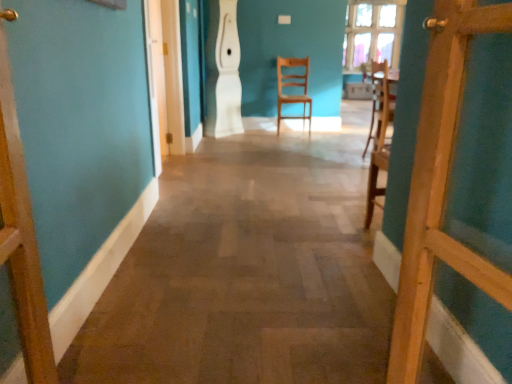
What do you see at coordinates (246, 274) in the screenshot?
I see `wooden floor at center` at bounding box center [246, 274].

What is the approximate width of wooden chair at right, placed as the second chair when sorted from left to right?

It is 13.85 inches.

This screenshot has height=384, width=512. Describe the element at coordinates (441, 182) in the screenshot. I see `wooden door at right` at that location.

You are a GUI agent. You are given a task and a screenshot of the screen. Output one action in this format:
    pyautogui.click(x=<x>, y=<y>)
    Task: Click on the light wood chair at center, placed as the second chair when sorted from front to back
    Image resolution: width=512 pixels, height=384 pixels.
    Given the screenshot: What is the action you would take?
    293,86

Between wooden door at right and wooden floor at center, which one has larger size?

With larger size is wooden floor at center.

Looking at this image, how far apart are wooden door at right and wooden floor at center?

wooden door at right and wooden floor at center are 39.05 inches apart.

Visually, is wooden door at right positioned to the left or to the right of wooden floor at center?

From the image, it's evident that wooden door at right is to the right of wooden floor at center.

Is wooden door at right taller or shorter than wooden floor at center?

In the image, wooden door at right appears to be taller than wooden floor at center.

Consider the image. From a real-world perspective, which is physically below, wooden door at right or wooden chair at right, the 1th chair positioned from the front?

wooden chair at right, the 1th chair positioned from the front, is physically lower.

From the image's perspective, which is above, wooden door at right or wooden chair at right, placed as the second chair when sorted from left to right?

From the image's view, wooden chair at right, placed as the second chair when sorted from left to right, is above.

Does wooden door at right have a greater height compared to wooden chair at right, the 2th chair viewed from the back?

Correct, wooden door at right is much taller as wooden chair at right, the 2th chair viewed from the back.

Which is closer to the camera, [374,47] or [504,239]?

The point [504,239] is closer to the camera.

This screenshot has width=512, height=384. In order to click on door lying on the left of clear glass window at upper center in this screenshot , I will do 441,182.

From a real-world perspective, between clear glass window at upper center and wooden door at right, who is vertically lower?

wooden door at right, from a real-world perspective.

Can wooden door at right be found inside clear glass window at upper center?

No.

Is wooden door at right not inside light wood chair at center, positioned as the 2th chair in right-to-left order?

Absolutely, wooden door at right is external to light wood chair at center, positioned as the 2th chair in right-to-left order.

Can you confirm if wooden door at right is bigger than light wood chair at center, placed as the second chair when sorted from front to back?

Actually, wooden door at right might be smaller than light wood chair at center, placed as the second chair when sorted from front to back.

Would you say wooden door at right is a long distance from light wood chair at center, the 1th chair viewed from the back?

That's right, there is a large distance between wooden door at right and light wood chair at center, the 1th chair viewed from the back.

From the image's perspective, starting from the wooden door at right, which chair is the 2nd one above? Please provide its 2D coordinates.

[(293, 86)]

Considering the points (392, 102) and (392, 301), which point is behind, point (392, 102) or point (392, 301)?

Positioned behind is point (392, 102).

From the image's perspective, between wooden chair at right, the 2th chair viewed from the back, and wooden floor at center, which one is located above?

From the image's view, wooden chair at right, the 2th chair viewed from the back, is above.

Is wooden chair at right, the 2th chair viewed from the back, oriented towards wooden floor at center?

No, wooden chair at right, the 2th chair viewed from the back, is not oriented towards wooden floor at center.

Looking at their sizes, would you say wooden chair at right, the 2th chair viewed from the back, is wider or thinner than wooden floor at center?

wooden chair at right, the 2th chair viewed from the back, is thinner than wooden floor at center.

How different are the orientations of clear glass window at upper center and light wood chair at center, the first chair when ordered from left to right, in degrees?

The facing directions of clear glass window at upper center and light wood chair at center, the first chair when ordered from left to right, are 1.35 degrees apart.

How much distance is there between clear glass window at upper center and light wood chair at center, the first chair when ordered from left to right?

They are 3.63 feet apart.

Is clear glass window at upper center placed right next to light wood chair at center, placed as the second chair when sorted from front to back?

No, clear glass window at upper center is not making contact with light wood chair at center, placed as the second chair when sorted from front to back.

In terms of height, does clear glass window at upper center look taller or shorter compared to light wood chair at center, the first chair when ordered from left to right?

clear glass window at upper center is shorter than light wood chair at center, the first chair when ordered from left to right.

Looking at this image, is the depth of light wood chair at center, positioned as the 2th chair in right-to-left order, less than that of wooden door at right?

That is False.

Does light wood chair at center, the first chair when ordered from left to right, have a lesser height compared to wooden door at right?

Yes.

Is light wood chair at center, placed as the second chair when sorted from front to back, turned away from wooden door at right?

light wood chair at center, placed as the second chair when sorted from front to back, does not have its back to wooden door at right.

From the image's perspective, is light wood chair at center, placed as the second chair when sorted from front to back, under wooden door at right?

Incorrect, from the image's perspective, light wood chair at center, placed as the second chair when sorted from front to back, is higher than wooden door at right.

This screenshot has height=384, width=512. I want to click on alley above the wooden door at right (from the image's perspective), so click(246, 274).

Where is `the 1st chair behind the wooden door at right`? Image resolution: width=512 pixels, height=384 pixels. the 1st chair behind the wooden door at right is located at coordinates (379, 98).

Based on their spatial positions, is wooden floor at center or wooden chair at right, the 2th chair viewed from the back, further from clear glass window at upper center?

wooden floor at center.

Which object lies nearer to the anchor point wooden floor at center, clear glass window at upper center or light wood chair at center, the 1th chair viewed from the back?

light wood chair at center, the 1th chair viewed from the back, is positioned closer to the anchor wooden floor at center.

Looking at the image, which one is located closer to wooden floor at center, wooden door at right or clear glass window at upper center?

wooden door at right is closer to wooden floor at center.

Estimate the real-world distances between objects in this image. Which object is further from light wood chair at center, the 1th chair viewed from the back, wooden chair at right, the 1th chair positioned from the front, or clear glass window at upper center?

wooden chair at right, the 1th chair positioned from the front.

Looking at the image, which one is located closer to wooden floor at center, wooden chair at right, the 2th chair viewed from the back, or light wood chair at center, positioned as the 2th chair in right-to-left order?

Among the two, wooden chair at right, the 2th chair viewed from the back, is located nearer to wooden floor at center.

Considering their positions, is wooden chair at right, the first chair viewed from the right, positioned closer to light wood chair at center, placed as the second chair when sorted from front to back, than wooden door at right?

wooden chair at right, the first chair viewed from the right, lies closer to light wood chair at center, placed as the second chair when sorted from front to back, than the other object.

From the image, which object appears to be nearer to wooden chair at right, the 1th chair positioned from the front, wooden floor at center or light wood chair at center, the first chair when ordered from left to right?

wooden floor at center is closer to wooden chair at right, the 1th chair positioned from the front.

Based on their spatial positions, is wooden chair at right, the 2th chair viewed from the back, or clear glass window at upper center closer to wooden floor at center?

wooden chair at right, the 2th chair viewed from the back, is closer to wooden floor at center.

I want to click on alley positioned between wooden door at right and wooden chair at right, the 1th chair positioned from the front, from near to far, so click(246, 274).

The image size is (512, 384). What are the coordinates of `chair between wooden chair at right, the first chair viewed from the right, and clear glass window at upper center in the front-back direction` in the screenshot? It's located at (293, 86).

Find the location of `chair between wooden floor at center and light wood chair at center, positioned as the 2th chair in right-to-left order, from front to back`. chair between wooden floor at center and light wood chair at center, positioned as the 2th chair in right-to-left order, from front to back is located at coordinates (379, 98).

Locate an element on the screen. Image resolution: width=512 pixels, height=384 pixels. alley located between wooden door at right and clear glass window at upper center in the depth direction is located at coordinates (246, 274).